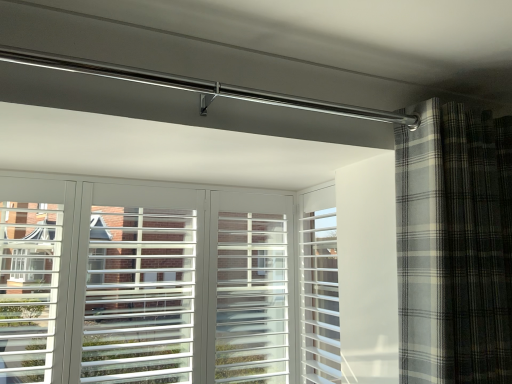
Question: From a real-world perspective, is plaid fabric curtain at right physically located above or below white plastic screen door at center?

Choices:
 (A) above
 (B) below

Answer: (A)

Question: Based on their sizes in the image, would you say plaid fabric curtain at right is bigger or smaller than white plastic screen door at center?

Choices:
 (A) small
 (B) big

Answer: (B)

Question: Is plaid fabric curtain at right spatially inside white plastic screen door at center, or outside of it?

Choices:
 (A) outside
 (B) inside

Answer: (A)

Question: From the image's perspective, is white plastic screen door at center above or below plaid fabric curtain at right?

Choices:
 (A) above
 (B) below

Answer: (B)

Question: Is white plastic screen door at center wider or thinner than plaid fabric curtain at right?

Choices:
 (A) wide
 (B) thin

Answer: (B)

Question: Would you say white plastic screen door at center is inside or outside plaid fabric curtain at right?

Choices:
 (A) outside
 (B) inside

Answer: (A)

Question: Is white plastic screen door at center to the left or to the right of plaid fabric curtain at right in the image?

Choices:
 (A) right
 (B) left

Answer: (B)